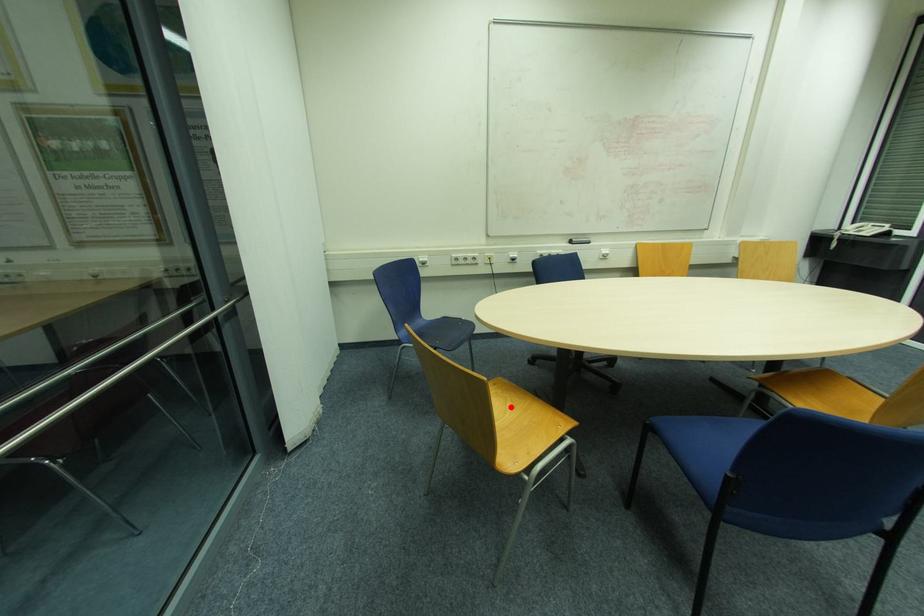
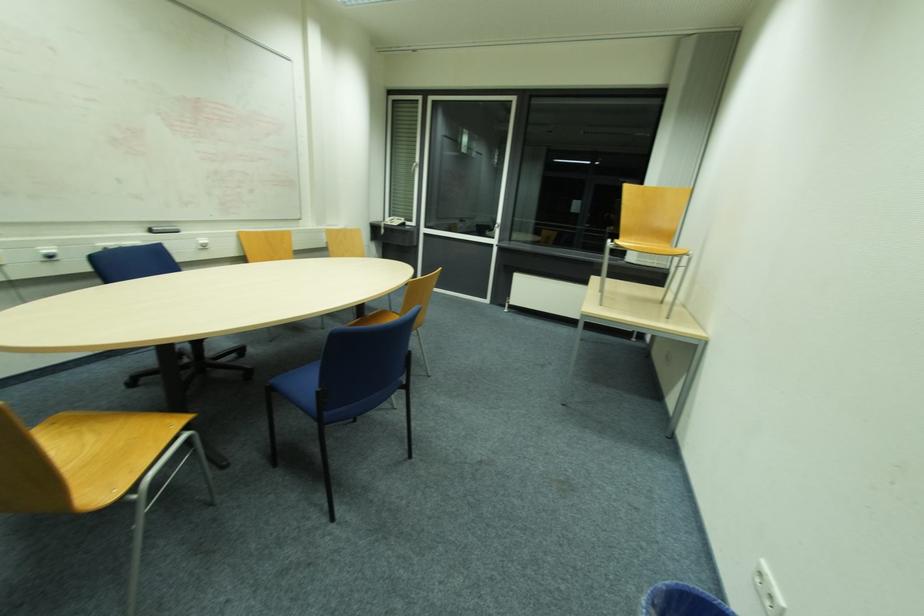
Question: I am providing you with two images of the same scene from different viewpoints. In image1, a red point is highlighted. Considering the same 3D point in image2, which of the following is correct?

Choices:
 (A) It is closer
 (B) It is farther

Answer: (B)